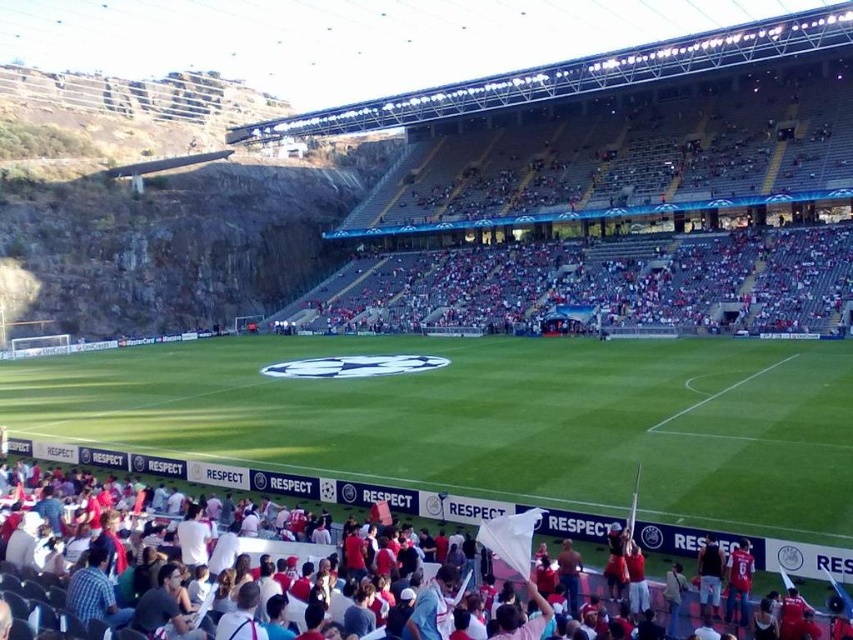
You are a photographer positioned at the camera location. You want to capture a closeup shot of the UEFA Champions League logo placed at point (x=413, y=637). What is the minimum focal length required to fill the frame with the logo if your camera sensor has a diagonal of 24mm and the logo has a diameter of 1.5 meters?

The minimum focal length required is approximately 24mm multiplied by the distance to the subject divided by the subject size. Using the formula focal length mm 24mm 20.75m 1.5m 24 20.75 1.5 332mm. Therefore, a focal length of approximately 332mm is needed to fill the frame with the UEFA Champions League logo at point (x=413, y=637).

Consider the image. You are a photographer positioned at the center of the football field. You want to capture a photo that includes both the white fabric crowd at lower left and the blue jersey at lower right. Based on their positions, which direction should you tilt your camera to include both in the frame?

Since the white fabric crowd at lower left is to the left of the blue jersey at lower right, you should tilt your camera to the left to include both in the frame.

Looking at this image, you are a photographer at the UEFA Champions League match. You want to capture a photo that highlights the UEFA Champions League logo in the center. Which group of fans, the white fabric crowd at lower left or the blue jersey at lower right, should you focus on to ensure they are in the foreground of your shot?

The white fabric crowd at lower left is bigger than the blue jersey at lower right, so focusing on the white fabric crowd at lower left will ensure they are in the foreground as they are larger and more prominent.